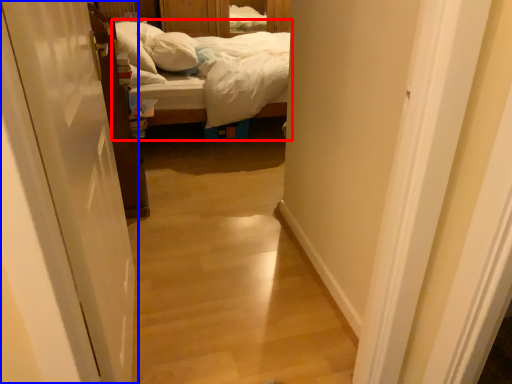
Question: Which of the following is the closest to the observer, bed (highlighted by a red box) or door (highlighted by a blue box)?

Choices:
 (A) bed
 (B) door

Answer: (B)